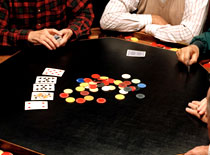
What are the coordinates of `brown table edge at the bottom left of the photo` in the screenshot? It's located at (16, 148).